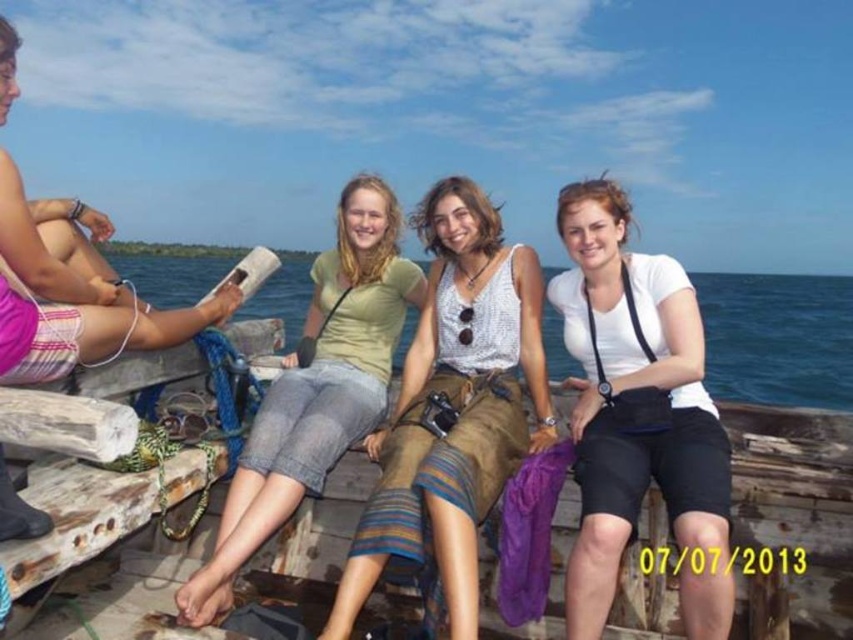
Between white matte shorts at right and pink woven shorts at left, which one has less height?

Standing shorter between the two is white matte shorts at right.

Is point (595, 227) positioned after point (225, 291)?

No, (595, 227) is in front of (225, 291).

At what (x,y) coordinates should I click in order to perform the action: click on white matte shorts at right. Please return your answer as a coordinate pair (x, y). Looking at the image, I should click on (x=640, y=433).

Between light green fabric skirt at center and pink woven shorts at left, which one is positioned higher?

Positioned higher is pink woven shorts at left.

Which of these two, light green fabric skirt at center or pink woven shorts at left, stands shorter?

pink woven shorts at left

Who is more distant from viewer, (469, 516) or (42, 376)?

A: Positioned behind is point (42, 376).

What are the coordinates of `light green fabric skirt at center` in the screenshot? It's located at (453, 412).

The image size is (853, 640). I want to click on light green fabric skirt at center, so click(x=453, y=412).

Which of these two, light green fabric skirt at center or white matte shorts at right, stands shorter?

With less height is white matte shorts at right.

Does point (418, 528) come closer to viewer compared to point (579, 593)?

No, it is behind (579, 593).

Where is `light green fabric skirt at center`? This screenshot has width=853, height=640. light green fabric skirt at center is located at coordinates (453, 412).